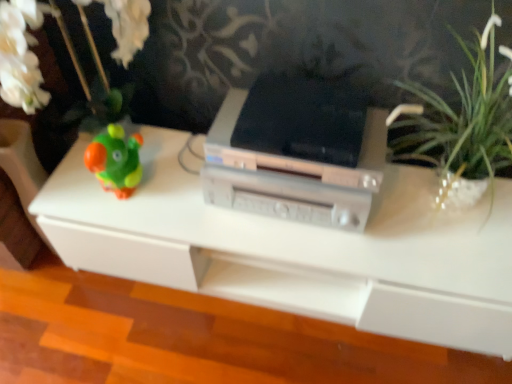
Question: Is silver metallic printer at center at the back of white plastic table at center?

Choices:
 (A) no
 (B) yes

Answer: (A)

Question: Does white plastic table at center have a lesser height compared to silver metallic printer at center?

Choices:
 (A) yes
 (B) no

Answer: (B)

Question: Considering the relative sizes of white plastic table at center and silver metallic printer at center in the image provided, is white plastic table at center bigger than silver metallic printer at center?

Choices:
 (A) yes
 (B) no

Answer: (A)

Question: Does white plastic table at center come behind silver metallic printer at center?

Choices:
 (A) no
 (B) yes

Answer: (A)

Question: From the image's perspective, is white plastic table at center over silver metallic printer at center?

Choices:
 (A) yes
 (B) no

Answer: (B)

Question: Can you confirm if white plastic table at center is wider than silver metallic printer at center?

Choices:
 (A) yes
 (B) no

Answer: (A)

Question: Is silver metallic printer at center oriented towards white plastic table at center?

Choices:
 (A) yes
 (B) no

Answer: (B)

Question: Considering the relative positions of silver metallic printer at center and white plastic table at center in the image provided, is silver metallic printer at center to the right of white plastic table at center from the viewer's perspective?

Choices:
 (A) no
 (B) yes

Answer: (A)

Question: Can you confirm if silver metallic printer at center is taller than white plastic table at center?

Choices:
 (A) yes
 (B) no

Answer: (B)

Question: Considering the relative sizes of silver metallic printer at center and white plastic table at center in the image provided, is silver metallic printer at center thinner than white plastic table at center?

Choices:
 (A) yes
 (B) no

Answer: (A)

Question: Would you say silver metallic printer at center is outside white plastic table at center?

Choices:
 (A) no
 (B) yes

Answer: (B)

Question: Can you see silver metallic printer at center touching white plastic table at center?

Choices:
 (A) no
 (B) yes

Answer: (A)

Question: From a real-world perspective, is silver metallic printer at center positioned above or below white plastic table at center?

Choices:
 (A) below
 (B) above

Answer: (B)